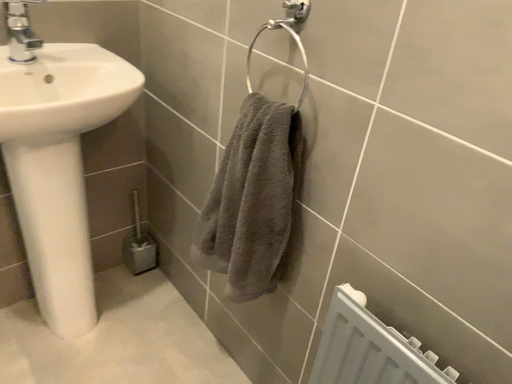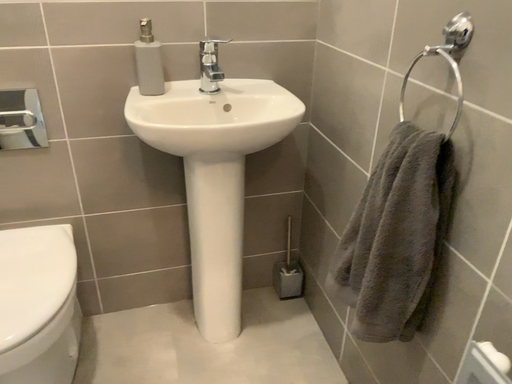
Question: Which way did the camera rotate in the video?

Choices:
 (A) rotated right
 (B) rotated left

Answer: (B)